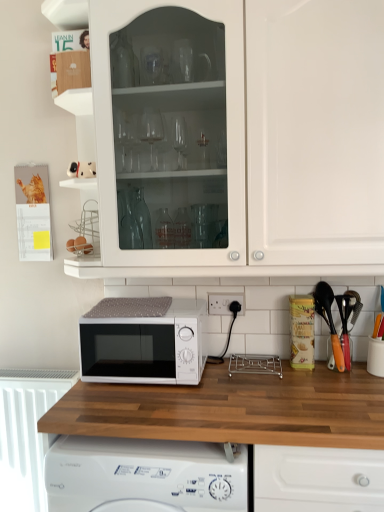
Question: Looking at their shapes, would you say white plastic electric outlet at lower center is wider or thinner than white plastic radiator at lower left?

Choices:
 (A) thin
 (B) wide

Answer: (A)

Question: Relative to white plastic radiator at lower left, is white plastic electric outlet at lower center in front or behind?

Choices:
 (A) front
 (B) behind

Answer: (A)

Question: Based on their relative distances, which object is farther from the white glossy cabinet at upper center?

Choices:
 (A) white matte microwave at center
 (B) white plastic electric outlet at lower center
 (C) wooden at center
 (D) white plastic radiator at lower left

Answer: (D)

Question: Which of these objects is positioned closest to the white plastic radiator at lower left?

Choices:
 (A) white matte microwave at center
 (B) wooden at center
 (C) white plastic electric outlet at lower center
 (D) white glossy cabinet at upper center

Answer: (A)